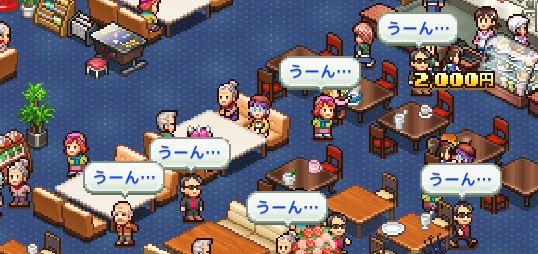
The width and height of the screenshot is (538, 254). In order to click on tables in this screenshot , I will do `click(533, 170)`.